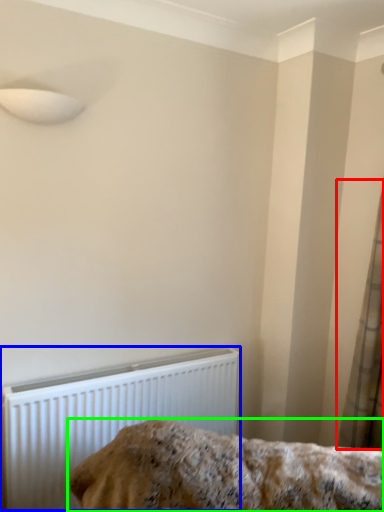
Question: Which is farther away from curtain (highlighted by a red box)? radiator (highlighted by a blue box) or furniture (highlighted by a green box)?

Choices:
 (A) radiator
 (B) furniture

Answer: (A)